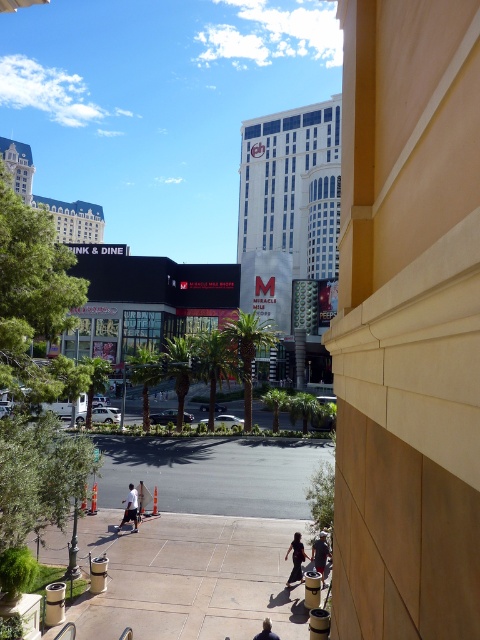
You are standing on the balcony of the beige building wall on the right. You notice a white glass building at center at point (x=292, y=228). Is the white glass building at center located to your left or right side?

The white glass building at center is located at point (x=292, y=228), which is to your left side.

You are standing on a balcony overlooking the city. You see a white glass building at center and a person with blonde hair at lower center. Which object is closer to you, the observer?

The blonde hair at lower center is closer to you because the white glass building at center is positioned over it, indicating it is further away.